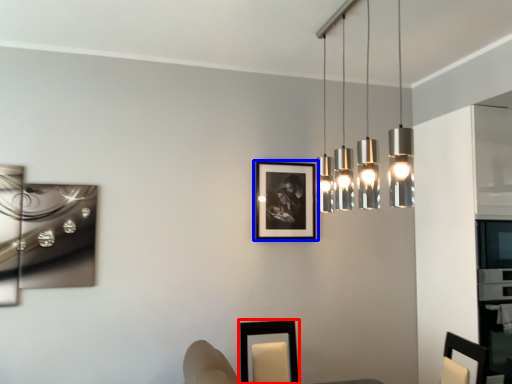
Question: Which object is further to the camera taking this photo, picture frame (highlighted by a red box) or picture frame (highlighted by a blue box)?

Choices:
 (A) picture frame
 (B) picture frame

Answer: (B)